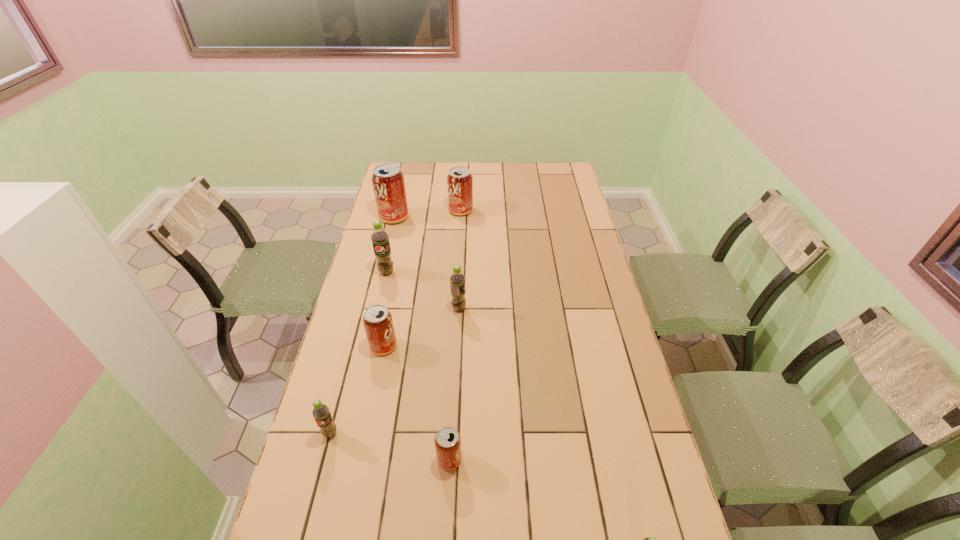
The width and height of the screenshot is (960, 540). I want to click on the third closest red soda can to the third green soda from left to right, so click(x=388, y=182).

Locate an element on the screen. red soda can that is the third closest to the third farthest soda is located at coordinates (459, 180).

Choose which green soda is the third nearest neighbor to the fifth farthest soda. Please provide its 2D coordinates. Your answer should be formatted as a tuple, i.e. [(x, y)], where the tuple contains the x and y coordinates of a point satisfying the conditions above.

[(380, 238)]

Point out which green soda is positioned as the nearest to the nearest red soda can. Please provide its 2D coordinates. Your answer should be formatted as a tuple, i.e. [(x, y)], where the tuple contains the x and y coordinates of a point satisfying the conditions above.

[(321, 414)]